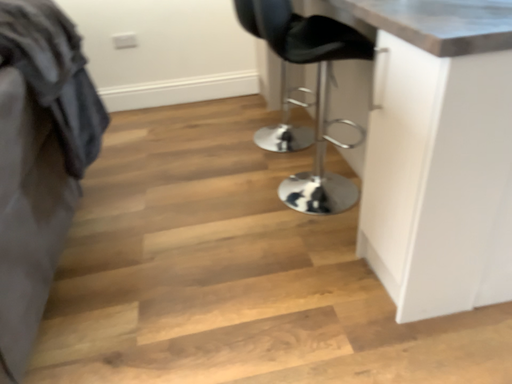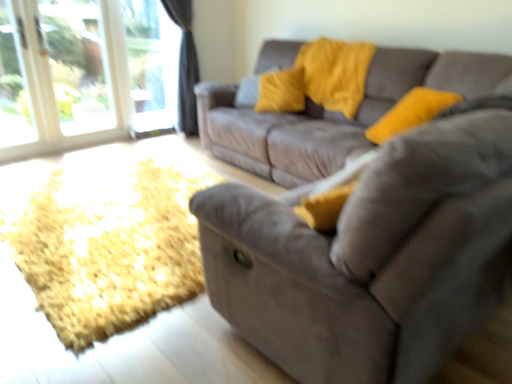
Question: How did the camera likely rotate when shooting the video?

Choices:
 (A) rotated right
 (B) rotated left

Answer: (B)